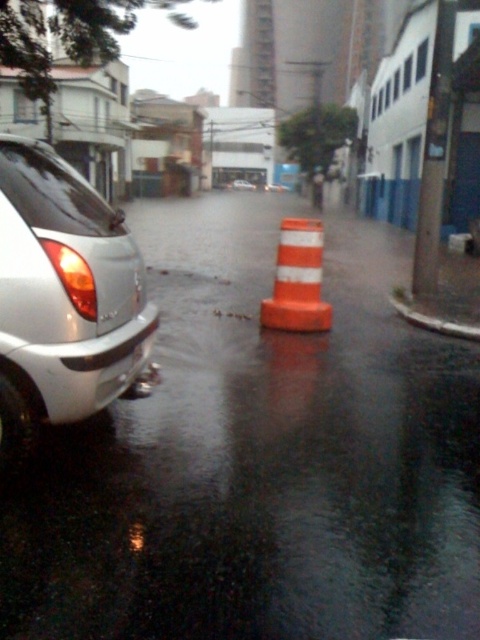
You are a delivery driver who needs to navigate around the glossy orange cone at center and the orange reflective cone at center. Since both are in the middle of the street, which one is directly on top of the other?

The glossy orange cone at center is positioned over orange reflective cone at center, so the glossy orange cone is directly on top of the orange reflective cone.

You are standing at the point marked by the coordinates [260,458] in the image. Looking around, you see a parked silver car on the left side of the street and a glossy orange cone at center. Which object is closer to your current position?

The point marked by the coordinates [260,458] is exactly where the glossy orange cone at center is located, so you are already at the glossy orange cone at center. Therefore, you are closest to the glossy orange cone at center.